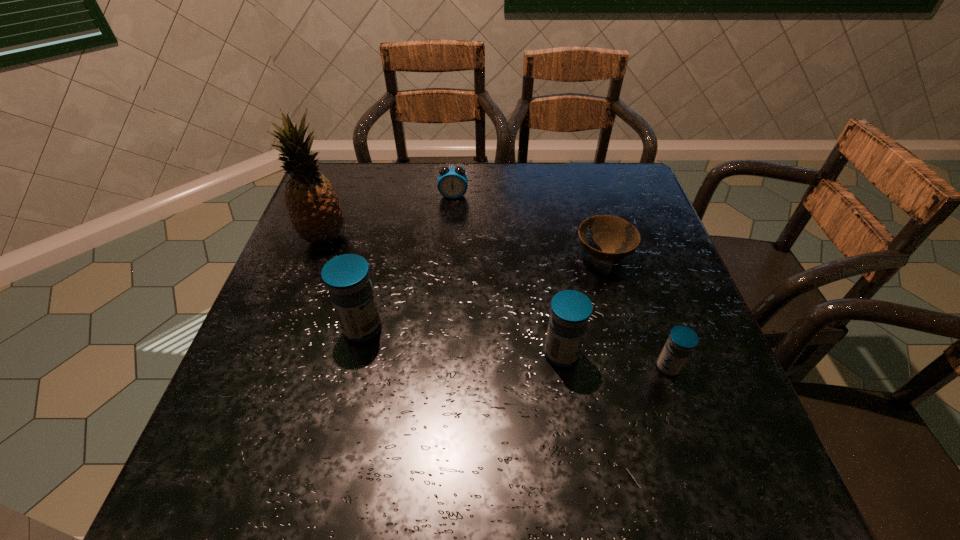
Locate an element on the screen. Image resolution: width=960 pixels, height=540 pixels. free space located on the right of the second medicine from left to right is located at coordinates (669, 354).

I want to click on blank space located on the back of the shortest medicine, so click(x=657, y=333).

Identify the location of free space located 0.340m on the face of the third object from left to right. tap(446, 288).

Identify the location of blank space located on the left of the bowl. (542, 256).

Locate an element on the screen. The width and height of the screenshot is (960, 540). vacant area located on the right of the pineapple is located at coordinates (500, 238).

Locate an element on the screen. The width and height of the screenshot is (960, 540). object that is at the far edge is located at coordinates (x=452, y=183).

Locate an element on the screen. object that is positioned at the left edge is located at coordinates (313, 206).

Where is `medicine that is at the right edge`? medicine that is at the right edge is located at coordinates (682, 340).

In order to click on bowl positioned at the right edge in this screenshot , I will do tap(617, 238).

What are the coordinates of `blank area at the far edge` in the screenshot? It's located at (569, 186).